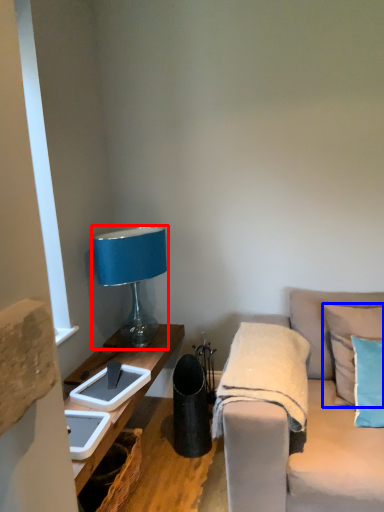
Question: Which object is further to the camera taking this photo, lamp (highlighted by a red box) or pillow (highlighted by a blue box)?

Choices:
 (A) lamp
 (B) pillow

Answer: (A)